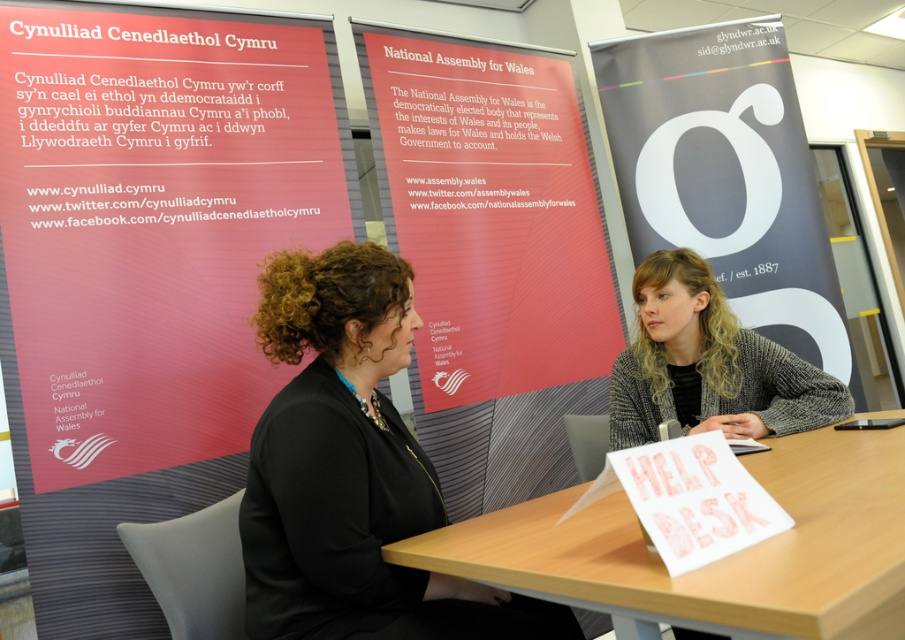
Question: Which object is closer to the camera taking this photo?

Choices:
 (A) wooden at center
 (B) black fabric jacket at center
 (C) matte red banner at left
 (D) gray woolen sweater at center

Answer: (A)

Question: Among these objects, which one is nearest to the camera?

Choices:
 (A) matte red banner at center
 (B) matte red banner at left
 (C) matte gray banner at center

Answer: (B)

Question: Can you confirm if black fabric jacket at center is positioned above gray woolen sweater at center?

Choices:
 (A) yes
 (B) no

Answer: (B)

Question: Which of the following is the closest to the observer?

Choices:
 (A) matte red banner at left
 (B) black fabric jacket at center
 (C) matte gray banner at center

Answer: (B)

Question: Can you confirm if black fabric jacket at center is bigger than wooden at center?

Choices:
 (A) no
 (B) yes

Answer: (A)

Question: In this image, where is matte red banner at center located relative to black fabric jacket at center?

Choices:
 (A) above
 (B) below

Answer: (A)